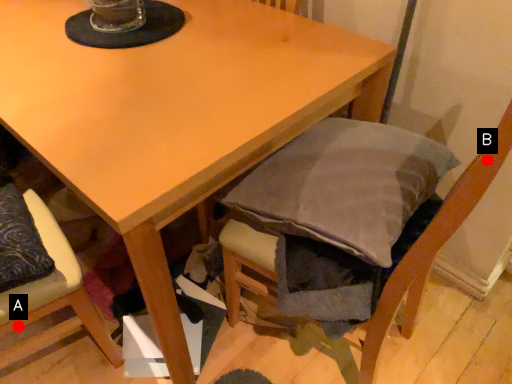
Question: Two points are circled on the image, labeled by A and B beside each circle. Which point appears closest to the camera in this image?

Choices:
 (A) A is closer
 (B) B is closer

Answer: (B)